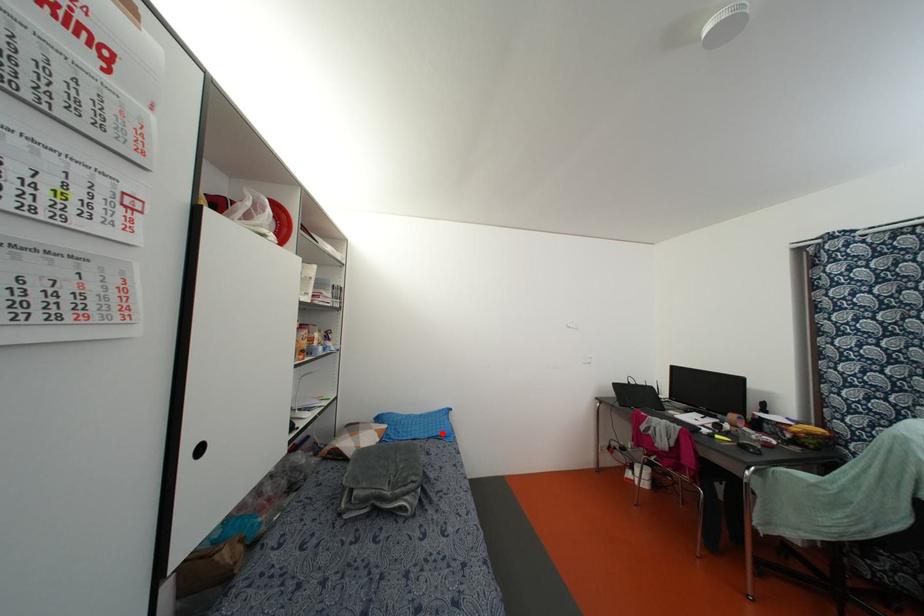
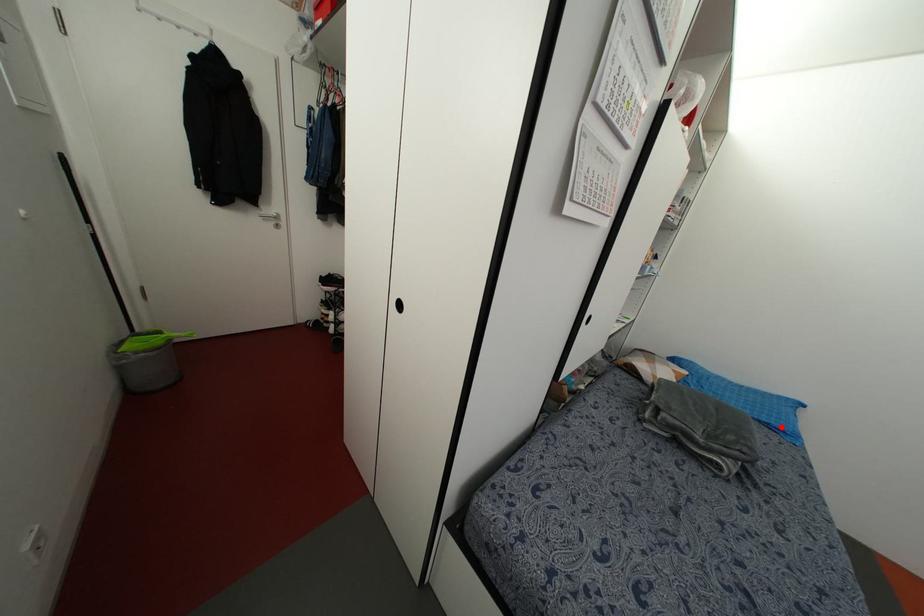
I am providing you with two images of the same scene from different viewpoints. A red point is marked on the first image and another point is marked on the second image. Are the points marked in image1 and image2 representing the same 3D position?

Yes